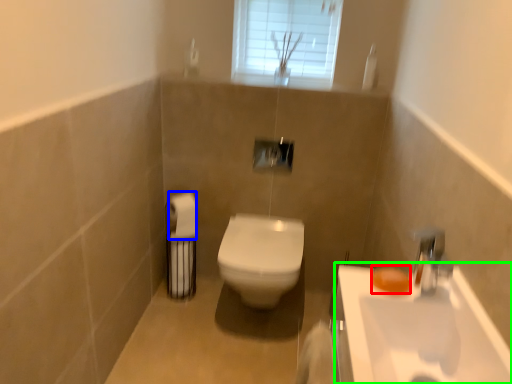
Question: Which is farther away from soap (highlighted by a red box)? toilet paper (highlighted by a blue box) or sink (highlighted by a green box)?

Choices:
 (A) toilet paper
 (B) sink

Answer: (A)